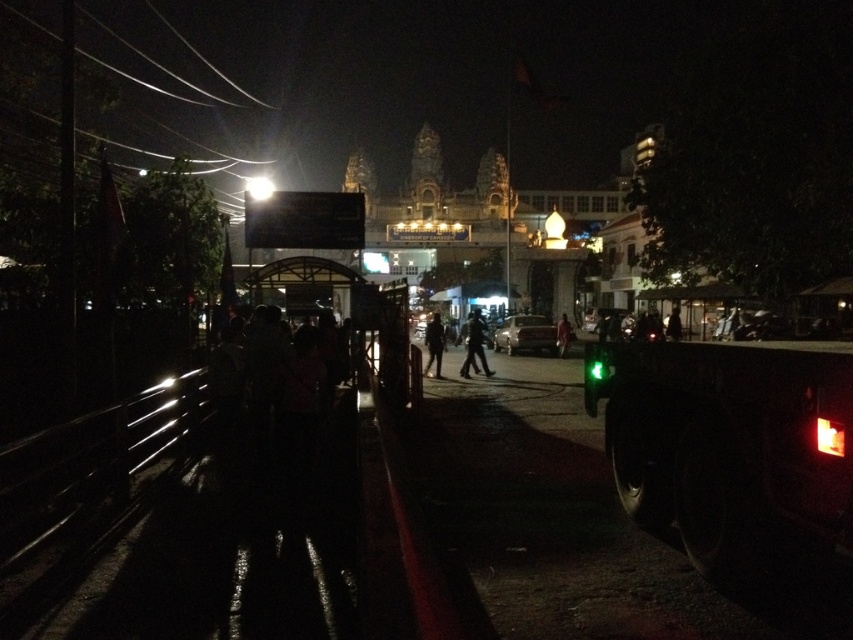
Question: Does black matte pants at center appear under red fabric person at center?

Choices:
 (A) yes
 (B) no

Answer: (A)

Question: Which object appears farthest from the camera in this image?

Choices:
 (A) dark fabric person at center
 (B) black matte pants at center

Answer: (B)

Question: Estimate the real-world distances between objects in this image. Which object is closer to the black matte pants at center?

Choices:
 (A) dark fabric person at center
 (B) red fabric person at center

Answer: (A)

Question: Considering the relative positions of black matte pants at center and dark fabric person at center in the image provided, where is black matte pants at center located with respect to dark fabric person at center?

Choices:
 (A) above
 (B) below

Answer: (A)

Question: Which point is farther to the camera?

Choices:
 (A) (474, 371)
 (B) (566, 314)

Answer: (B)

Question: Is black matte pants at center smaller than red fabric person at center?

Choices:
 (A) yes
 (B) no

Answer: (B)